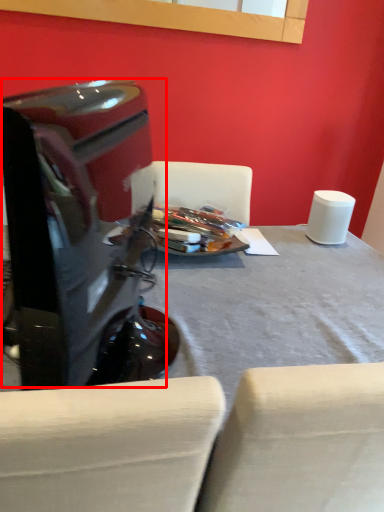
Question: From the image's perspective, what is the correct spatial relationship of computer monitor (annotated by the red box) in relation to table?

Choices:
 (A) below
 (B) above

Answer: (B)